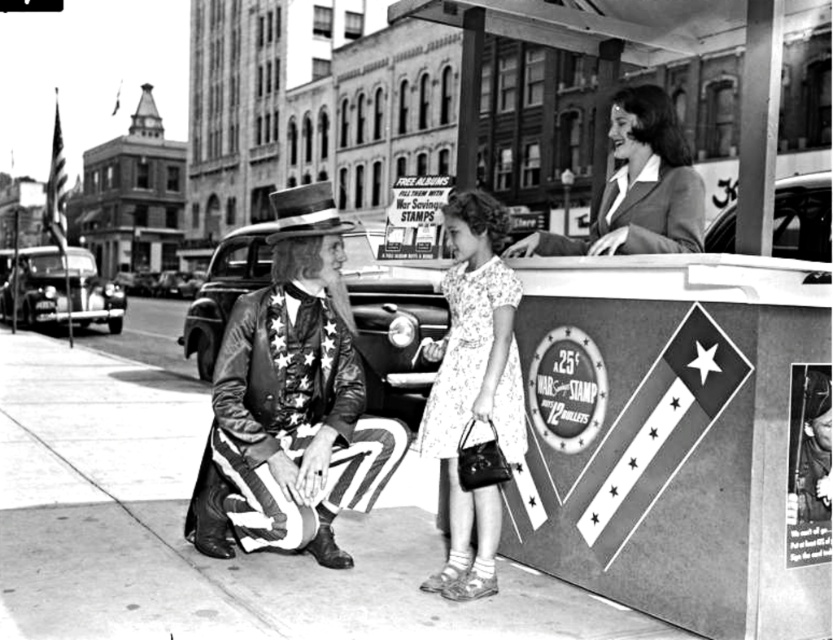
You are an observer standing on the street in the image. You notice two people dressed in different outfits. The first person is wearing a floral cotton dress at center, and the second is wearing a smooth black suit at upper right. Which outfit appears to be narrower in width?

The floral cotton dress at center is thinner than the smooth black suit at upper right, so the floral cotton dress at center appears to be narrower in width.